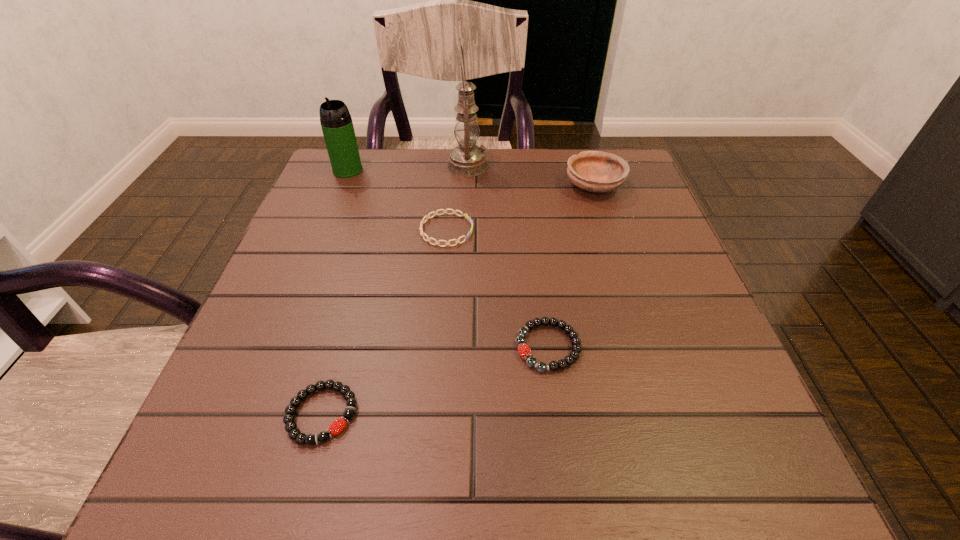
Locate an element on the screen. object at the near edge is located at coordinates (335, 428).

Find the location of a particular element. thermos bottle at the left edge is located at coordinates (336, 122).

Where is `bracelet located at the left edge`? The image size is (960, 540). bracelet located at the left edge is located at coordinates (335, 428).

I want to click on object present at the right edge, so click(x=595, y=171).

You are a GUI agent. You are given a task and a screenshot of the screen. Output one action in this format:
    pyautogui.click(x=<x>, y=<y>)
    Task: Click on the object present at the far left corner
    This screenshot has height=540, width=960.
    Given the screenshot: What is the action you would take?
    pyautogui.click(x=336, y=122)

This screenshot has height=540, width=960. I want to click on object present at the near left corner, so click(x=335, y=428).

The height and width of the screenshot is (540, 960). Identify the location of object present at the far right corner. (595, 171).

Where is `vacant space at the far edge`? This screenshot has height=540, width=960. vacant space at the far edge is located at coordinates (476, 199).

The image size is (960, 540). I want to click on blank space at the near edge of the desktop, so click(478, 449).

Locate an element on the screen. The height and width of the screenshot is (540, 960). free space at the left edge is located at coordinates (323, 313).